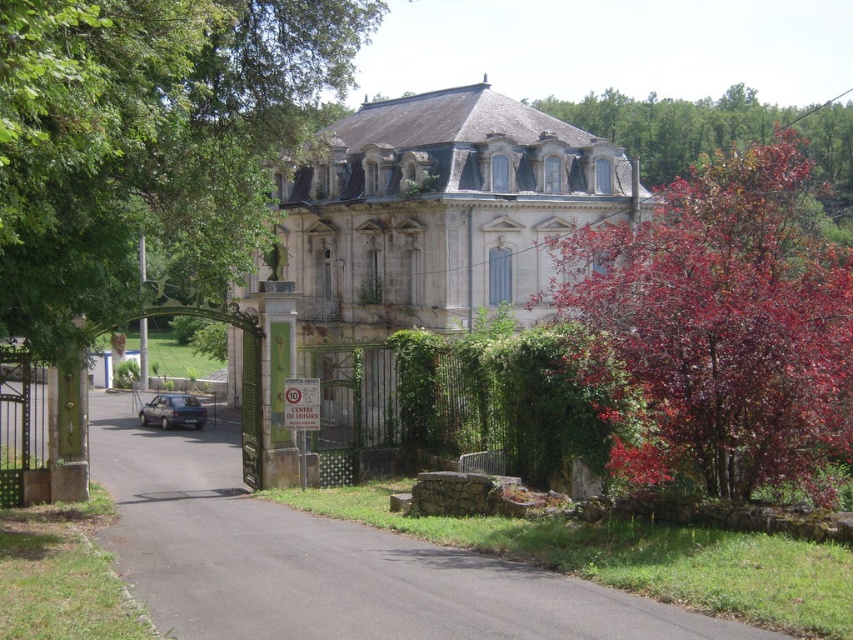
Question: Is red glossy tree at right positioned behind purple leafy tree at upper right?

Choices:
 (A) no
 (B) yes

Answer: (A)

Question: Which object appears farthest from the camera in this image?

Choices:
 (A) purple leafy tree at upper right
 (B) green leafy tree at upper left
 (C) black asphalt driveway at center

Answer: (A)

Question: Which object is closer to the camera taking this photo?

Choices:
 (A) slate gray metallic hatchback at lower left
 (B) black asphalt driveway at center

Answer: (B)

Question: Which point is farther to the camera?

Choices:
 (A) (502, 618)
 (B) (49, 150)
 (C) (787, 186)

Answer: (C)

Question: From the image, what is the correct spatial relationship of green leafy tree at upper left in relation to black asphalt driveway at center?

Choices:
 (A) left
 (B) right

Answer: (A)

Question: Is black asphalt driveway at center positioned behind slate gray metallic hatchback at lower left?

Choices:
 (A) yes
 (B) no

Answer: (B)